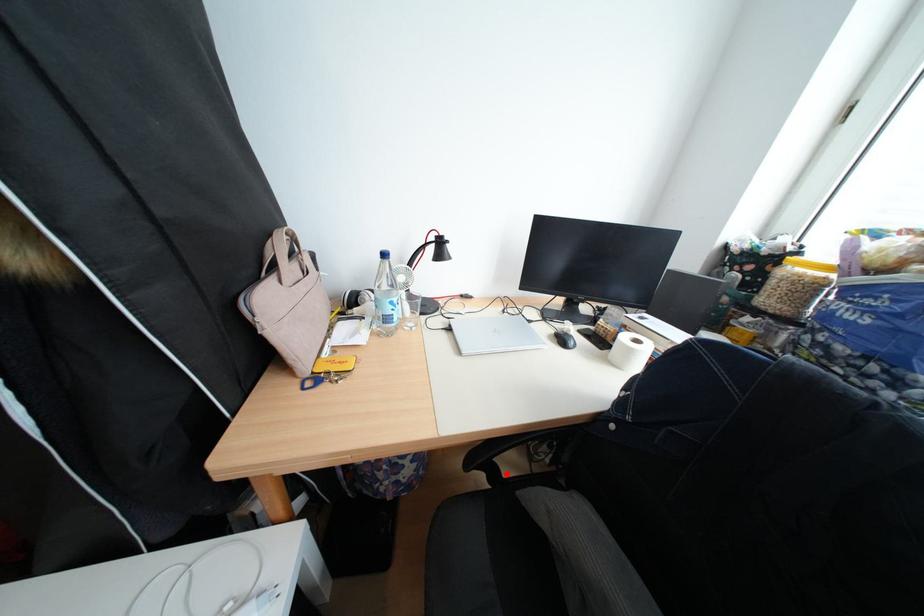
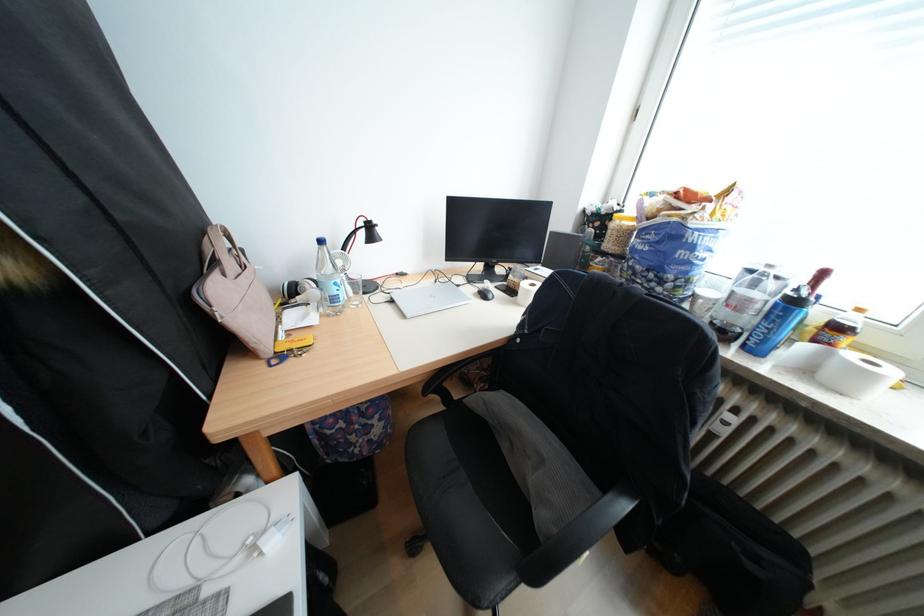
Where in the second image is the point corresponding to the highlighted location from the first image?

(458, 398)